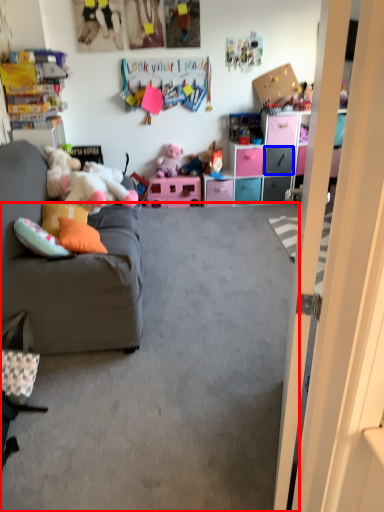
Question: Which object appears closest to the camera in this image, plain (highlighted by a red box) or drawer (highlighted by a blue box)?

Choices:
 (A) plain
 (B) drawer

Answer: (A)